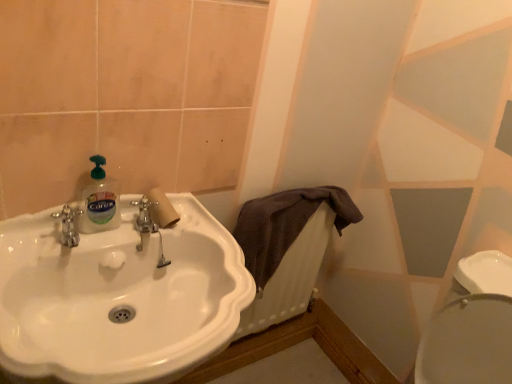
What do you see at coordinates (119, 297) in the screenshot?
I see `white glossy sink at center` at bounding box center [119, 297].

Locate an element on the screen. The image size is (512, 384). translucent plastic bottle at sink left is located at coordinates (100, 201).

Identify the location of brown fabric radiator at center. The height and width of the screenshot is (384, 512). (291, 277).

This screenshot has height=384, width=512. What do you see at coordinates (285, 224) in the screenshot?
I see `purple cotton towel at center` at bounding box center [285, 224].

The image size is (512, 384). Identify the location of white glossy sink at center. (119, 297).

Based on the photo, is translucent plastic bottle at sink left turned away from brown fabric radiator at center?

That's not correct — translucent plastic bottle at sink left is not looking away from brown fabric radiator at center.

Does translucent plastic bottle at sink left have a greater height compared to brown fabric radiator at center?

Incorrect, the height of translucent plastic bottle at sink left is not larger of that of brown fabric radiator at center.

Is translucent plastic bottle at sink left positioned far away from brown fabric radiator at center?

Actually, translucent plastic bottle at sink left and brown fabric radiator at center are a little close together.

Which of these two, translucent plastic bottle at sink left or brown fabric radiator at center, is thinner?

With smaller width is brown fabric radiator at center.

How different are the orientations of translucent plastic bottle at sink left and purple cotton towel at center in degrees?

There is a 0.0084-degree angle between the facing directions of translucent plastic bottle at sink left and purple cotton towel at center.

Is translucent plastic bottle at sink left facing towards purple cotton towel at center?

No, translucent plastic bottle at sink left is not turned towards purple cotton towel at center.

From the image's perspective, is translucent plastic bottle at sink left over purple cotton towel at center?

Indeed, from the image's perspective, translucent plastic bottle at sink left is shown above purple cotton towel at center.

How much distance is there between translucent plastic bottle at sink left and purple cotton towel at center?

A distance of 21.24 inches exists between translucent plastic bottle at sink left and purple cotton towel at center.

Could brown fabric radiator at center be considered to be inside purple cotton towel at center?

Absolutely, brown fabric radiator at center is inside purple cotton towel at center.

Is point (246, 258) more distant than point (255, 321)?

No, (246, 258) is closer to viewer.

Based on the photo, from a real-world perspective, which object stands above the other?

purple cotton towel at center.

Could you tell me if translucent plastic bottle at sink left is facing white glossy sink at center?

No, translucent plastic bottle at sink left is not aimed at white glossy sink at center.

What's the angular difference between translucent plastic bottle at sink left and white glossy sink at center's facing directions?

There is a 0.0072-degree angle between the facing directions of translucent plastic bottle at sink left and white glossy sink at center.

Is translucent plastic bottle at sink left to the left or to the right of white glossy sink at center in the image?

In the image, translucent plastic bottle at sink left appears on the left side of white glossy sink at center.

Is translucent plastic bottle at sink left next to white glossy sink at center?

No, translucent plastic bottle at sink left is not with white glossy sink at center.

In terms of height, does purple cotton towel at center look taller or shorter compared to white glossy sink at center?

purple cotton towel at center is shorter than white glossy sink at center.

From a real-world perspective, is purple cotton towel at center positioned above or below white glossy sink at center?

In terms of real-world spatial position, purple cotton towel at center is above white glossy sink at center.

Is purple cotton towel at center behind white glossy sink at center?

Yes, it is.

Is purple cotton towel at center not within white glossy sink at center?

Indeed, purple cotton towel at center is completely outside white glossy sink at center.

Which of these two, brown fabric radiator at center or translucent plastic bottle at sink left, is thinner?

With smaller width is brown fabric radiator at center.

This screenshot has height=384, width=512. I want to click on cleaning product on the left of the brown fabric radiator at center, so click(100, 201).

Is brown fabric radiator at center bigger than translucent plastic bottle at sink left?

Correct, brown fabric radiator at center is larger in size than translucent plastic bottle at sink left.

From the image's perspective, between brown fabric radiator at center and translucent plastic bottle at sink left, who is located below?

brown fabric radiator at center, from the image's perspective.

Is white glossy sink at center directly adjacent to translucent plastic bottle at sink left?

No, white glossy sink at center is not beside translucent plastic bottle at sink left.

Between white glossy sink at center and translucent plastic bottle at sink left, which one has smaller size?

translucent plastic bottle at sink left.

Can we say white glossy sink at center lies outside translucent plastic bottle at sink left?

white glossy sink at center lies outside translucent plastic bottle at sink left's area.

From the image's perspective, does white glossy sink at center appear lower than translucent plastic bottle at sink left?

Indeed, from the image's perspective, white glossy sink at center is shown beneath translucent plastic bottle at sink left.

Find the location of a particular element. This screenshot has width=512, height=384. radiator below the translucent plastic bottle at sink left (from a real-world perspective) is located at coordinates (291, 277).

Locate an element on the screen. The image size is (512, 384). cleaning product that appears above the purple cotton towel at center (from a real-world perspective) is located at coordinates (100, 201).

Looking at the image, which one is located further to white glossy sink at center, purple cotton towel at center or brown fabric radiator at center?

brown fabric radiator at center is further to white glossy sink at center.

From the image, which object appears to be farther from purple cotton towel at center, translucent plastic bottle at sink left or white glossy sink at center?

translucent plastic bottle at sink left lies further to purple cotton towel at center than the other object.

When comparing their distances from translucent plastic bottle at sink left, does white glossy sink at center or purple cotton towel at center seem closer?

white glossy sink at center.

Estimate the real-world distances between objects in this image. Which object is closer to purple cotton towel at center, white glossy sink at center or brown fabric radiator at center?

The object closer to purple cotton towel at center is brown fabric radiator at center.

Looking at the image, which one is located closer to translucent plastic bottle at sink left, brown fabric radiator at center or purple cotton towel at center?

Among the two, purple cotton towel at center is located nearer to translucent plastic bottle at sink left.

Looking at this image, estimate the real-world distances between objects in this image. Which object is further from white glossy sink at center, translucent plastic bottle at sink left or purple cotton towel at center?

purple cotton towel at center.

Which object lies nearer to the anchor point white glossy sink at center, brown fabric radiator at center or translucent plastic bottle at sink left?

translucent plastic bottle at sink left.

Which object lies nearer to the anchor point brown fabric radiator at center, translucent plastic bottle at sink left or purple cotton towel at center?

purple cotton towel at center is closer to brown fabric radiator at center.

The width and height of the screenshot is (512, 384). Identify the location of bath towel between white glossy sink at center and brown fabric radiator at center from front to back. (285, 224).

This screenshot has height=384, width=512. I want to click on cleaning product positioned between white glossy sink at center and brown fabric radiator at center from near to far, so click(100, 201).

Where is `radiator between translucent plastic bottle at sink left and purple cotton towel at center from left to right`? radiator between translucent plastic bottle at sink left and purple cotton towel at center from left to right is located at coordinates (291, 277).

Where is `cleaning product between white glossy sink at center and purple cotton towel at center from front to back`? Image resolution: width=512 pixels, height=384 pixels. cleaning product between white glossy sink at center and purple cotton towel at center from front to back is located at coordinates (100, 201).